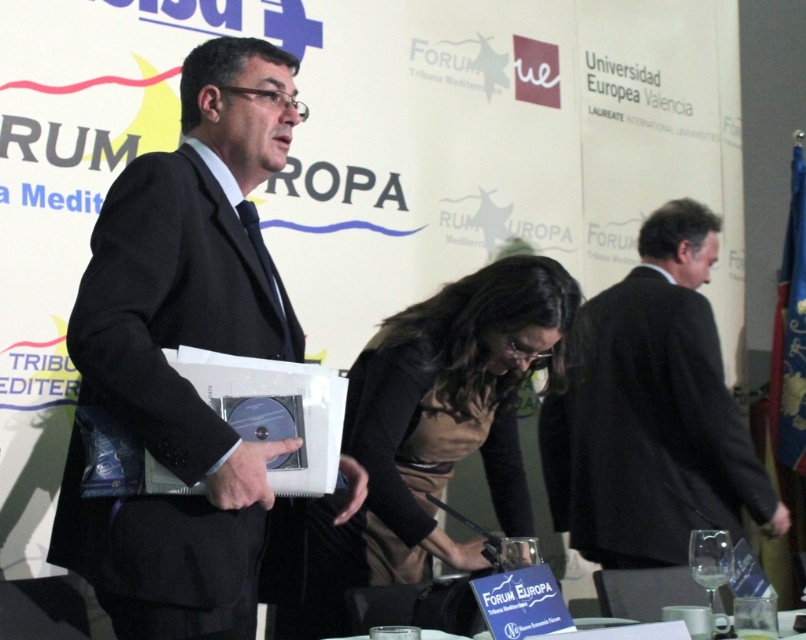
You are organizing a photo shoot for an event and need to place a prop at the position of the black suit at center. According to the coordinates provided, where should you position the prop?

The black suit at center is located at point (651,412), so you should position the prop at those coordinates.

You are an event photographer at the FORUM EUROPA conference. You need to take a photo of the black suit at center and the brown fabric dress at center. Which one is on the right side when facing the scene?

The black suit at center is positioned on the right side of brown fabric dress at center, so when facing the scene, the black suit at center is on the right side of the brown fabric dress at center.